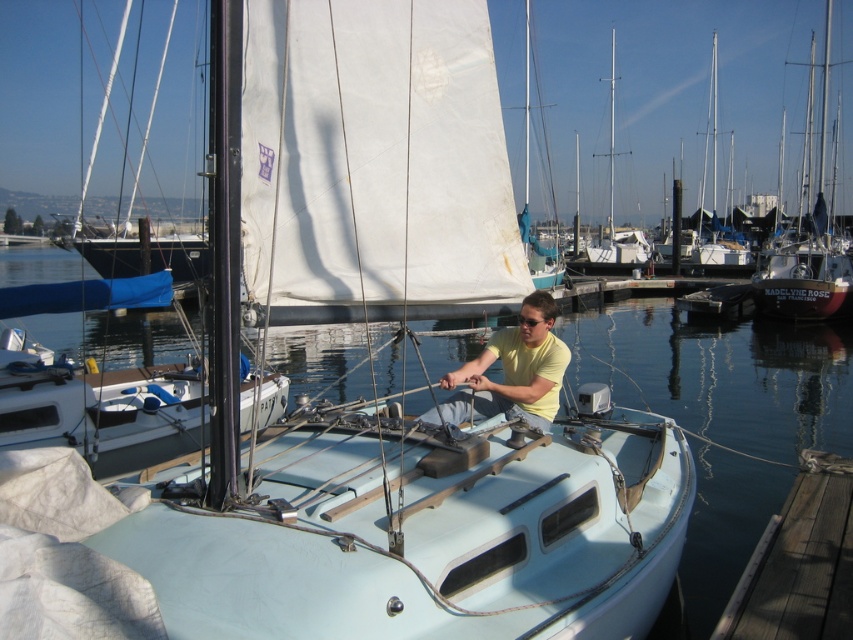
Question: Does white matte sailboat at center appear on the left side of yellow matte shirt at center?

Choices:
 (A) yes
 (B) no

Answer: (A)

Question: Considering the real-world distances, which object is farthest from the clear water at center?

Choices:
 (A) white matte sailboat at center
 (B) red matte sailboat at right

Answer: (B)

Question: Is white matte sailboat at center above yellow matte shirt at center?

Choices:
 (A) no
 (B) yes

Answer: (A)

Question: Which object is the farthest from the yellow matte shirt at center?

Choices:
 (A) wooden at lower right
 (B) clear water at center

Answer: (B)

Question: Which object is positioned closest to the clear water at center?

Choices:
 (A) red matte sailboat at right
 (B) wooden at lower right

Answer: (B)

Question: Does wooden at lower right appear on the right side of red matte sailboat at right?

Choices:
 (A) yes
 (B) no

Answer: (B)